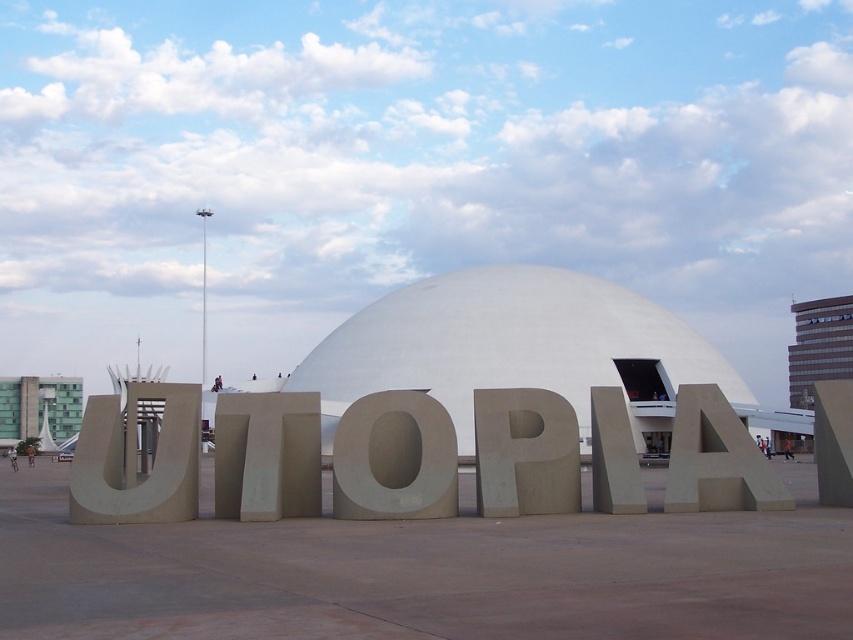
Which is above, concrete letter o at center or matte gray letter p at center?

concrete letter o at center is higher up.

Does concrete letter o at center have a greater width compared to matte gray letter p at center?

Indeed, concrete letter o at center has a greater width compared to matte gray letter p at center.

The image size is (853, 640). I want to click on concrete letter o at center, so click(393, 458).

I want to click on concrete letter o at center, so click(x=393, y=458).

Who is positioned more to the left, white smooth dome at center or gray concrete letter u at center?

gray concrete letter u at center is more to the left.

From the picture: Who is more forward, (601, 288) or (120, 458)?

Point (120, 458) is more forward.

Is point (410, 300) closer to viewer compared to point (134, 445)?

No, (410, 300) is behind (134, 445).

Where is `white smooth dome at center`? This screenshot has width=853, height=640. white smooth dome at center is located at coordinates (508, 344).

How distant is matte gray letter p at center from gray concrete letter at center?

The distance of matte gray letter p at center from gray concrete letter at center is 2.41 meters.

The width and height of the screenshot is (853, 640). What do you see at coordinates (525, 452) in the screenshot? I see `matte gray letter p at center` at bounding box center [525, 452].

Locate an element on the screen. matte gray letter p at center is located at coordinates (525, 452).